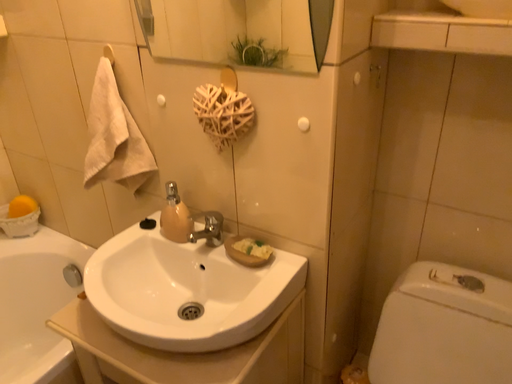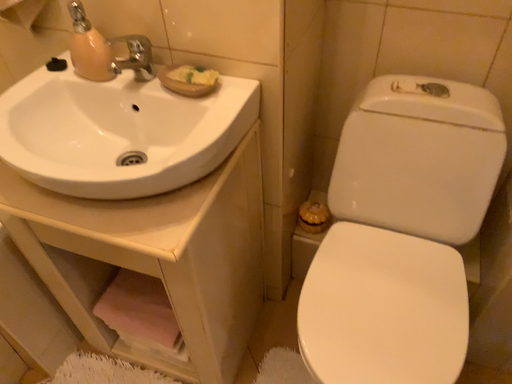
Question: Which way did the camera rotate in the video?

Choices:
 (A) rotated left
 (B) rotated right

Answer: (B)